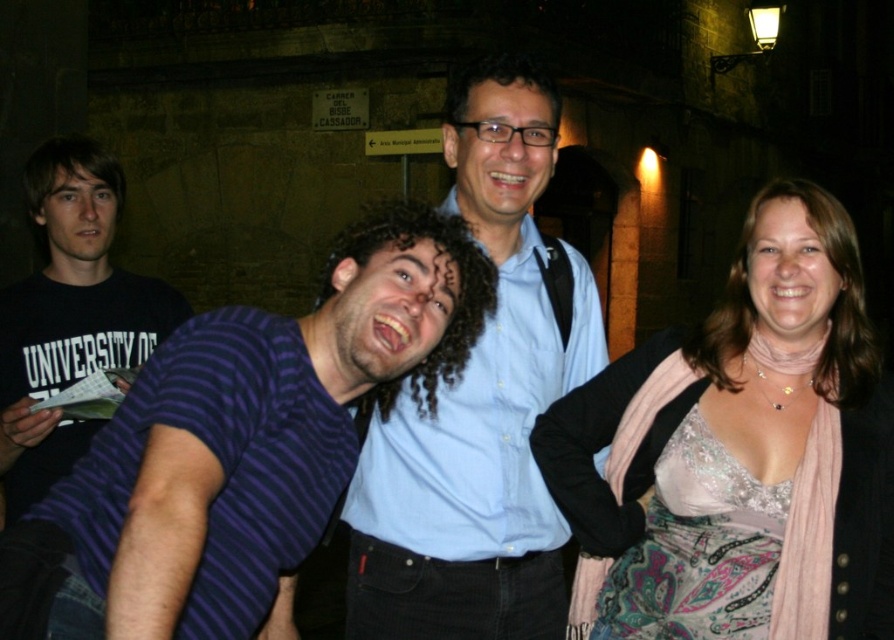
Can you confirm if pale pink silk scarf at right is bigger than black cotton t-shirt at left?

No.

Does pale pink silk scarf at right lie behind black cotton t-shirt at left?

No.

Which is in front, point (692, 433) or point (95, 237)?

Point (692, 433) is more forward.

Where is `pale pink silk scarf at right`? Image resolution: width=894 pixels, height=640 pixels. pale pink silk scarf at right is located at coordinates (739, 452).

Is point (665, 520) positioned behind point (688, 588)?

Yes, it is behind point (688, 588).

Which is below, pale pink silk scarf at right or satin lace dress at lower right?

pale pink silk scarf at right is lower down.

Where is `pale pink silk scarf at right`? This screenshot has height=640, width=894. pale pink silk scarf at right is located at coordinates (739, 452).

Locate an element on the screen. pale pink silk scarf at right is located at coordinates (739, 452).

Between point (388, 403) and point (699, 470), which one is positioned behind?

Point (388, 403)

Who is more forward, (401, 228) or (724, 621)?

Point (724, 621) is in front.

The width and height of the screenshot is (894, 640). I want to click on purple striped shirt at center, so click(242, 444).